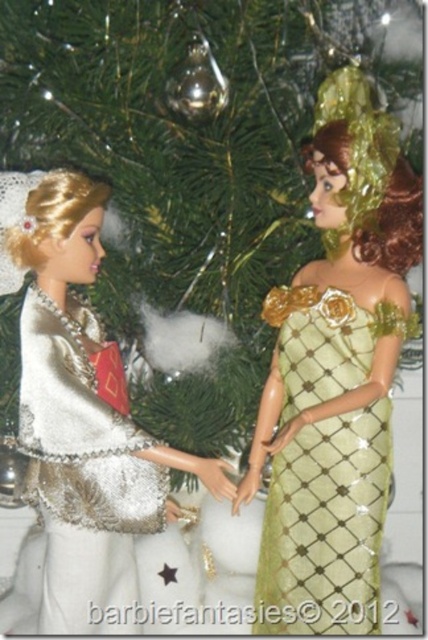
Is gold sequined dress at center to the left of white sequined dress at left from the viewer's perspective?

No, gold sequined dress at center is not to the left of white sequined dress at left.

Which is above, gold sequined dress at center or white sequined dress at left?

white sequined dress at left

Between point (302, 292) and point (62, 342), which one is positioned in front?

Point (302, 292) is more forward.

Identify the location of gold sequined dress at center. (326, 525).

Who is higher up, matte silver gown at left or white sequined dress at left?

white sequined dress at left is above.

Between matte silver gown at left and white sequined dress at left, which one is positioned lower?

matte silver gown at left is lower down.

Is point (136, 564) behind point (38, 305)?

Yes.

What are the coordinates of `matte silver gown at left` in the screenshot? It's located at (86, 422).

Can you confirm if matte silver gown at left is bigger than gold sequined dress at center?

Yes.

Based on the photo, is matte silver gown at left further to the viewer compared to gold sequined dress at center?

Yes, matte silver gown at left is further from the viewer.

What do you see at coordinates (86, 422) in the screenshot? The width and height of the screenshot is (428, 640). I see `matte silver gown at left` at bounding box center [86, 422].

This screenshot has width=428, height=640. What are the coordinates of `matte silver gown at left` in the screenshot? It's located at (86, 422).